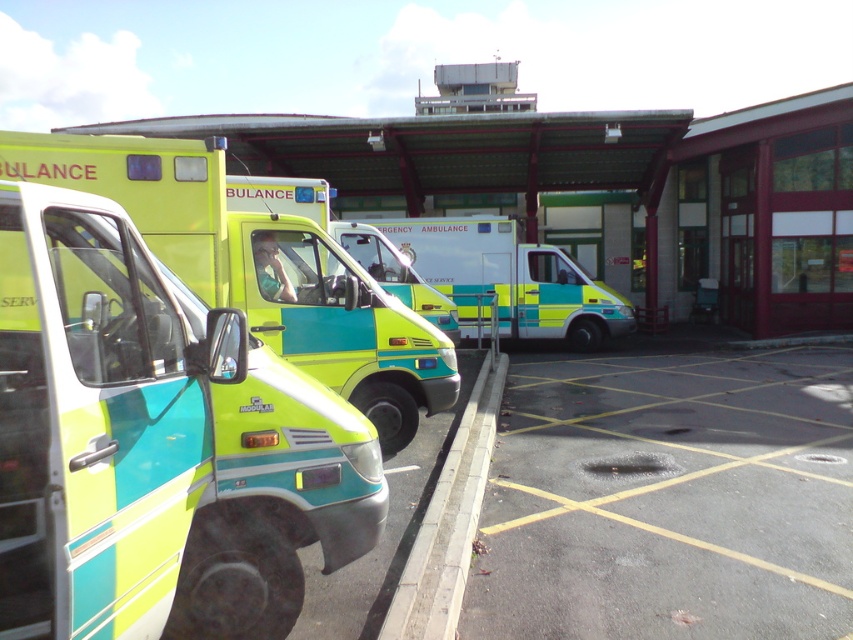
You are standing at the point marked as point [833,628] in the ambulance station. You need to walk to the entrance of the station, which is located 5 meters away from your current position. Can you reach the entrance without moving more than 5 meters?

The distance between point [833,628] and the viewer is 4.25 meters. Since the entrance is 5 meters away from your current position, you can reach it without moving more than 5 meters because 4.25 meters is less than 5 meters.

You are a parking attendant at the ambulance station. You need to park a new ambulance that is 2.5 meters wide. There are two ambulances in the center area, a matte green ambulance at center and a matte green and yellow ambulance at center. Which ambulance has a width that allows the new ambulance to fit in the parking space if the space is designed for vehicles up to 3 meters wide?

The matte green ambulance at center has a greater width than the matte green and yellow ambulance at center. Since the parking space allows up to 3 meters, the new ambulance at 2.5 meters can fit in either space, but the matte green and yellow ambulance at center has a smaller width, so its parking space might be more suitable if the space is sized for its dimensions. However, both spaces can accommodate the new ambulance as 2.5 meters is under 3 meters.